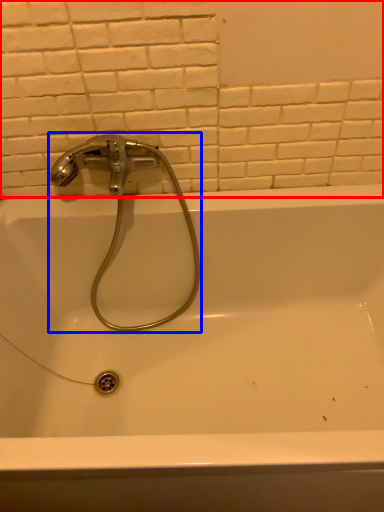
Question: Which of the following is the farthest to the observer, ceramic tile (highlighted by a red box) or tap (highlighted by a blue box)?

Choices:
 (A) ceramic tile
 (B) tap

Answer: (B)